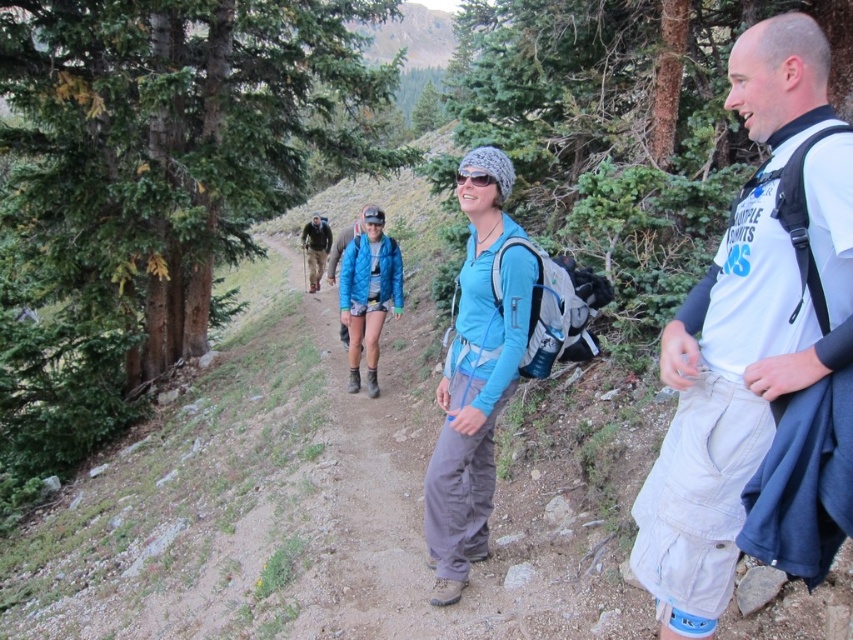
Question: Is matte blue shirt at center to the left of brown fabric jacket at center from the viewer's perspective?

Choices:
 (A) no
 (B) yes

Answer: (A)

Question: Considering the real-world distances, which object is closest to the white cotton t-shirt at center?

Choices:
 (A) matte blue shirt at center
 (B) brown fabric jacket at center

Answer: (A)

Question: Which point is closer to the camera?

Choices:
 (A) (769, 308)
 (B) (329, 243)
 (C) (450, 364)

Answer: (A)

Question: Is white cotton t-shirt at center positioned before brown fabric jacket at center?

Choices:
 (A) no
 (B) yes

Answer: (B)

Question: Which of the following is the closest to the observer?

Choices:
 (A) (457, 324)
 (B) (321, 260)

Answer: (A)

Question: From the image, what is the correct spatial relationship of white cotton t-shirt at center in relation to brown fabric jacket at center?

Choices:
 (A) below
 (B) above

Answer: (A)